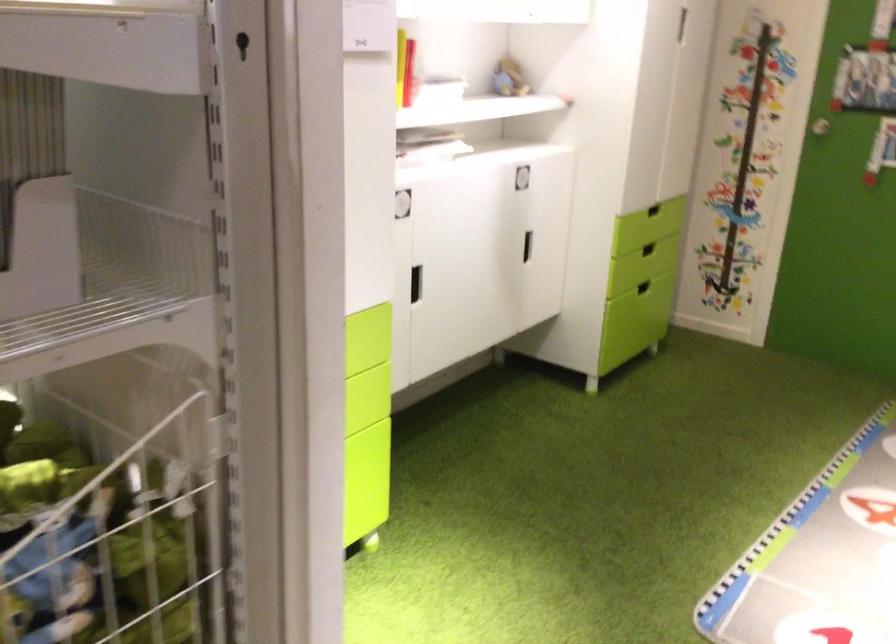
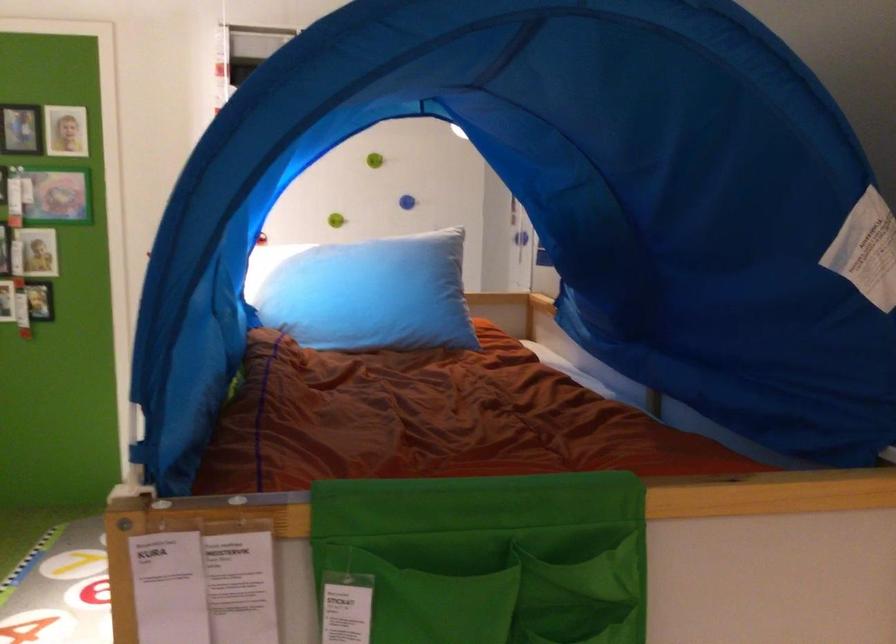
Question: The first image is from the beginning of the video and the second image is from the end. How did the camera likely rotate when shooting the video?

Choices:
 (A) Left
 (B) Right
 (C) Up
 (D) Down

Answer: (B)